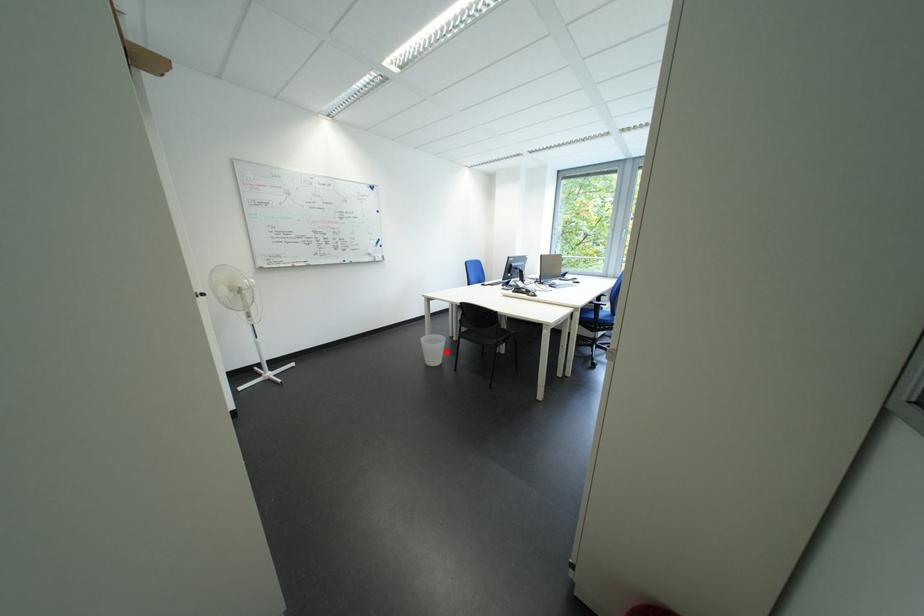
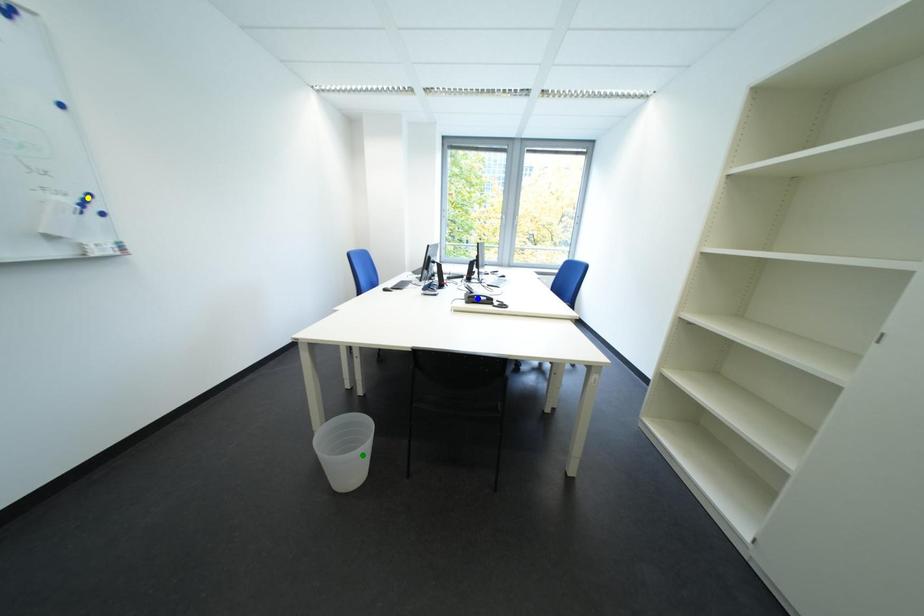
Question: I am providing you with two images of the same scene from different viewpoints. A red point is marked on the first image. You are given multiple points on the second image. Which point in image 2 is actually the same real-world point as the red point in image 1?

Choices:
 (A) green point
 (B) blue point
 (C) yellow point

Answer: (A)